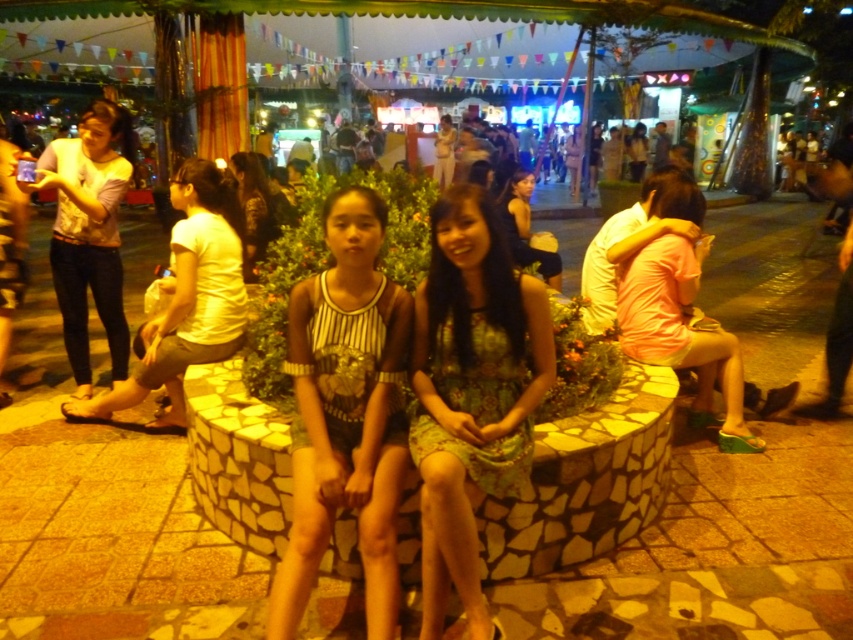
You are standing in the plaza and see two points in the image. The first point is at coordinates point (341, 339) and the second is at point (653, 321). Which point is nearer to you?

Point (341, 339) is closer to the viewer than point (653, 321).

You are a photographer trying to capture both the striped fabric dress at center and the pink fabric dress at right in a single frame. Which dress should you adjust to be closer to the camera to ensure both are in focus?

The striped fabric dress at center is shorter than the pink fabric dress at right. To ensure both are in focus, you should move the striped fabric dress at center closer to the camera so its distance matches the pink fabric dress at right.

You are a photographer trying to capture both the printed fabric dress at center and the pink fabric dress at right in a single frame. Given their widths, which dress will appear smaller in the photo?

The printed fabric dress at center will appear smaller in the photo because its width is less than the pink fabric dress at right.